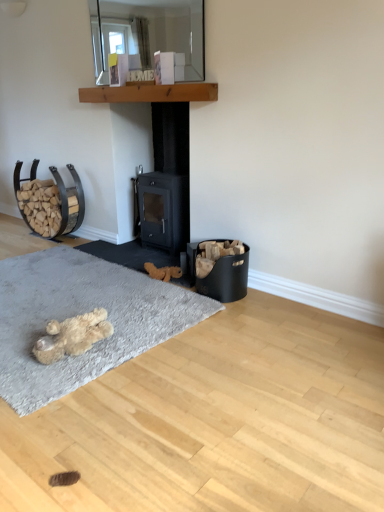
This screenshot has width=384, height=512. In order to click on free space that is to the left of brown plush toy at center, which is counted as the 2th animal, starting from the left in this screenshot , I will do `click(132, 275)`.